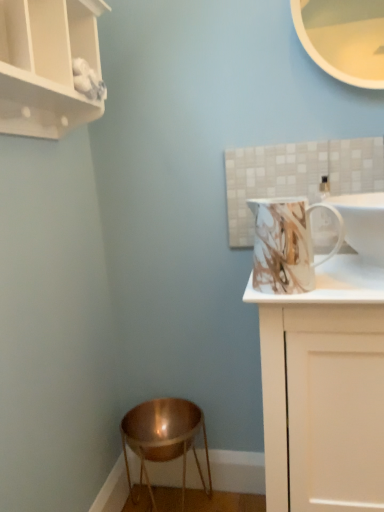
Question: Should I look upward or downward to see white matte cupboard at upper left?

Choices:
 (A) down
 (B) up

Answer: (B)

Question: From a real-world perspective, is white glossy cabinet at right physically below marble-patterned ceramic mug at upper right?

Choices:
 (A) yes
 (B) no

Answer: (A)

Question: Is white glossy cabinet at right touching marble-patterned ceramic mug at upper right?

Choices:
 (A) no
 (B) yes

Answer: (A)

Question: Is white glossy cabinet at right at the left side of marble-patterned ceramic mug at upper right?

Choices:
 (A) no
 (B) yes

Answer: (A)

Question: Is white glossy cabinet at right far away from marble-patterned ceramic mug at upper right?

Choices:
 (A) yes
 (B) no

Answer: (B)

Question: Is white glossy cabinet at right smaller than marble-patterned ceramic mug at upper right?

Choices:
 (A) no
 (B) yes

Answer: (A)

Question: Is white glossy cabinet at right wider than marble-patterned ceramic mug at upper right?

Choices:
 (A) yes
 (B) no

Answer: (A)

Question: From the image's perspective, is white glossy sink at upper right on white matte cupboard at upper left?

Choices:
 (A) no
 (B) yes

Answer: (A)

Question: From the image's perspective, is white glossy sink at upper right below white matte cupboard at upper left?

Choices:
 (A) no
 (B) yes

Answer: (B)

Question: Would you say white glossy sink at upper right is outside white matte cupboard at upper left?

Choices:
 (A) no
 (B) yes

Answer: (B)

Question: Is white glossy sink at upper right positioned in front of white matte cupboard at upper left?

Choices:
 (A) no
 (B) yes

Answer: (A)

Question: Is white glossy sink at upper right not close to white matte cupboard at upper left?

Choices:
 (A) no
 (B) yes

Answer: (A)

Question: Is white glossy sink at upper right positioned with its back to white matte cupboard at upper left?

Choices:
 (A) yes
 (B) no

Answer: (B)

Question: From the image's perspective, is white matte cupboard at upper left above white glossy cabinet at right?

Choices:
 (A) no
 (B) yes

Answer: (B)